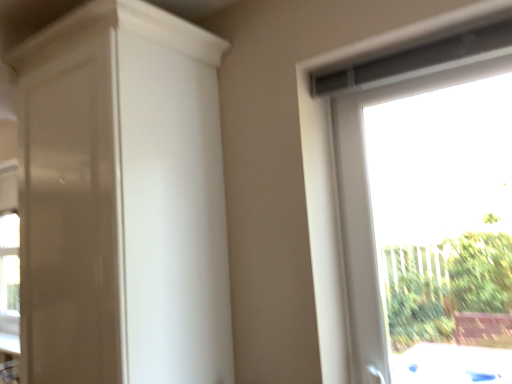
At what (x,y) coordinates should I click in order to perform the action: click on glossy white dresser at left. Please return your answer as a coordinate pair (x, y). The width and height of the screenshot is (512, 384). Looking at the image, I should click on (123, 200).

The width and height of the screenshot is (512, 384). Describe the element at coordinates (123, 200) in the screenshot. I see `glossy white dresser at left` at that location.

Where is `glossy white dresser at left`? The image size is (512, 384). glossy white dresser at left is located at coordinates (123, 200).